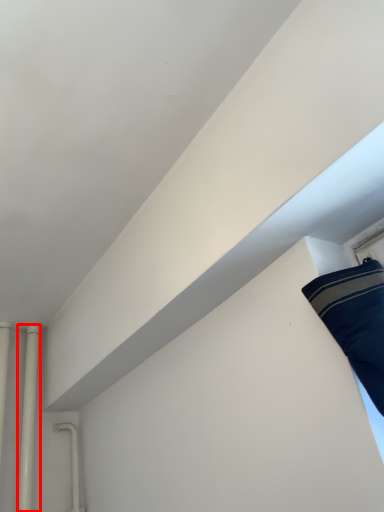
Question: Where is pipe (annotated by the red box) located in relation to pipe in the image?

Choices:
 (A) right
 (B) left

Answer: (A)